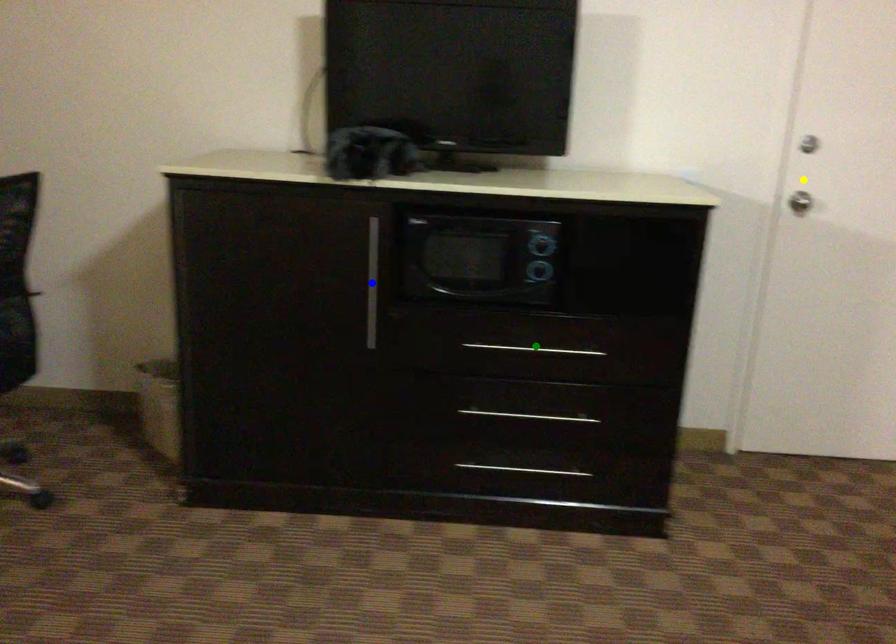
Order these from nearest to farthest:
yellow point | green point | blue point

yellow point, blue point, green point